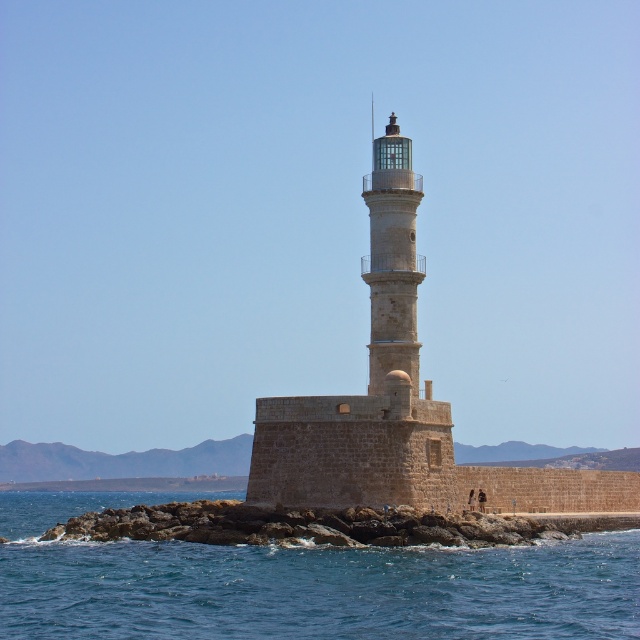
Question: Which point is closer to the camera?

Choices:
 (A) (394, 228)
 (B) (12, 550)
 (C) (403, 173)

Answer: (B)

Question: Which point is farther from the camera taking this photo?

Choices:
 (A) (196, 561)
 (B) (413, 282)
 (C) (344, 413)

Answer: (B)

Question: Observing the image, what is the correct spatial positioning of blue water at lower left in reference to smooth stone lighthouse at center?

Choices:
 (A) right
 (B) left

Answer: (B)

Question: Which of the following is the farthest from the observer?

Choices:
 (A) smooth stone lighthouse at center
 (B) beige stone lighthouse at center
 (C) blue water at lower left

Answer: (A)

Question: Can you confirm if beige stone lighthouse at center is thinner than smooth stone lighthouse at center?

Choices:
 (A) no
 (B) yes

Answer: (A)

Question: Is beige stone lighthouse at center in front of smooth stone lighthouse at center?

Choices:
 (A) yes
 (B) no

Answer: (A)